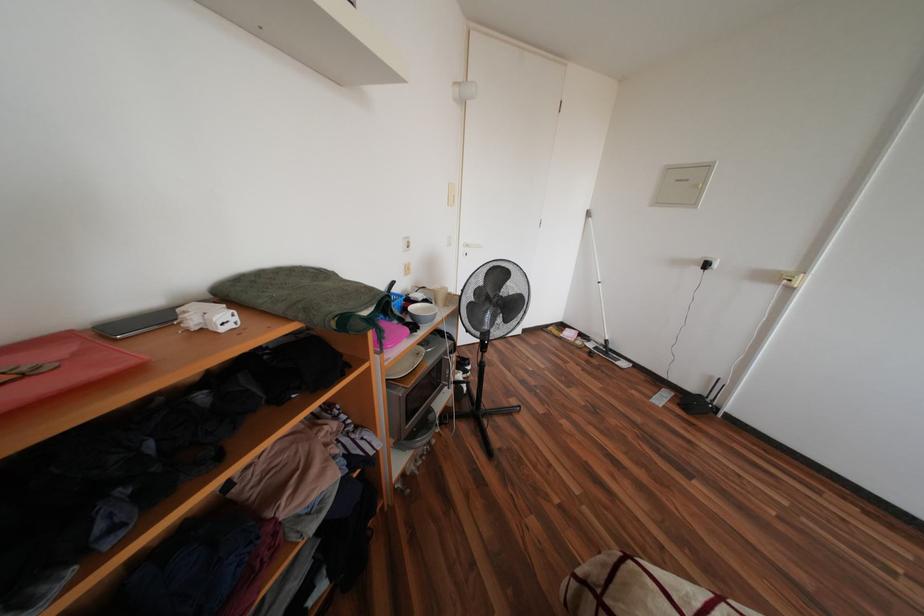
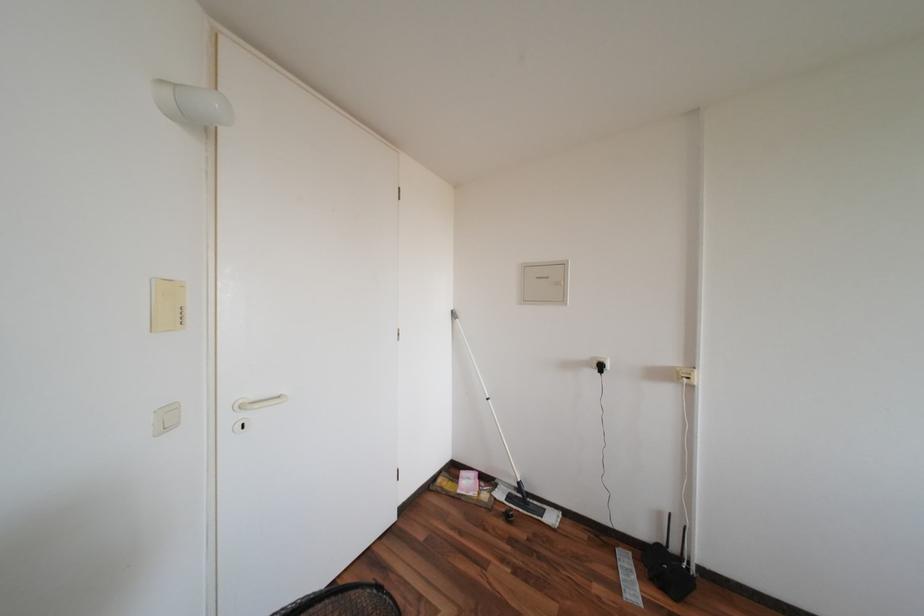
Based on the continuous images, in which direction is the camera rotating?

The camera's rotation is toward right-up.